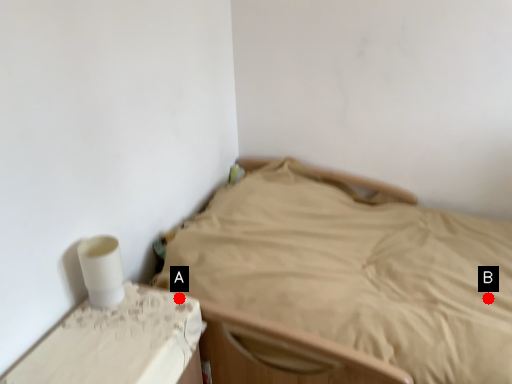
Question: Two points are circled on the image, labeled by A and B beside each circle. Which point appears farthest from the camera in this image?

Choices:
 (A) A is further
 (B) B is further

Answer: (B)